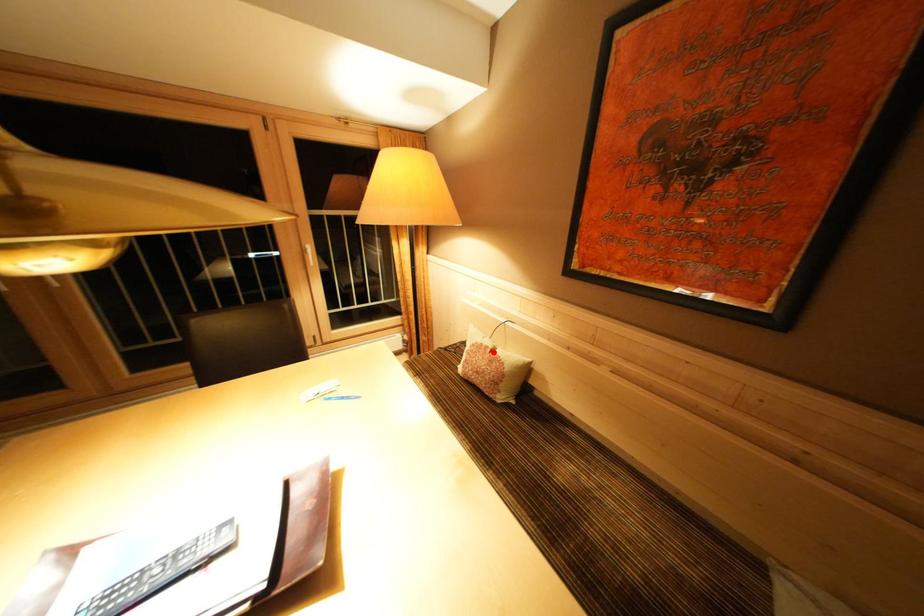
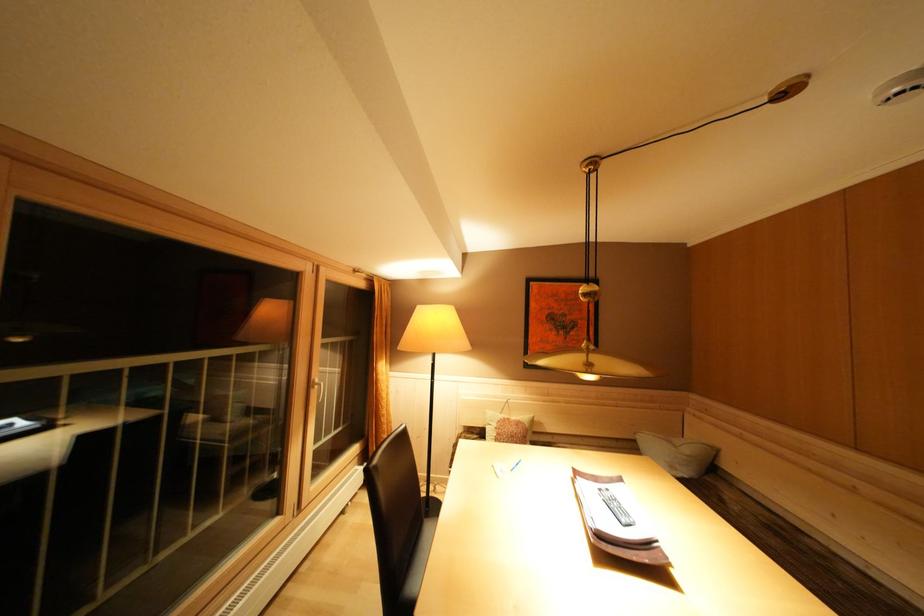
Where in the second image is the point corresponding to the highlighted location from the first image?

(515, 424)